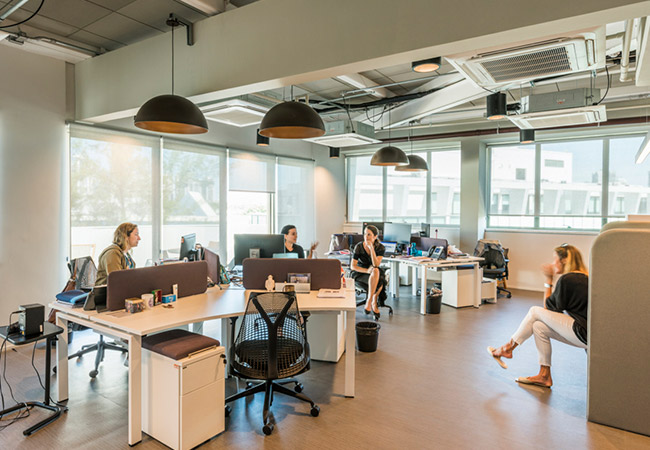
The width and height of the screenshot is (650, 450). Identify the location of windows. (107, 190), (205, 190), (266, 211), (296, 194), (369, 178), (398, 194), (445, 193), (514, 187), (582, 183), (638, 183).